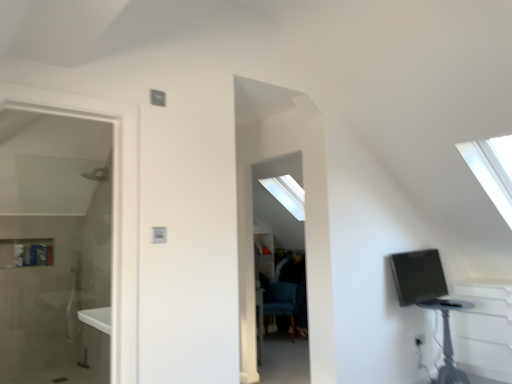
Question: Is the position of matte black monitor at right less distant than that of blue fabric swivel chair at center?

Choices:
 (A) yes
 (B) no

Answer: (A)

Question: Is the depth of matte black monitor at right greater than that of blue fabric swivel chair at center?

Choices:
 (A) no
 (B) yes

Answer: (A)

Question: Would you consider matte black monitor at right to be distant from blue fabric swivel chair at center?

Choices:
 (A) no
 (B) yes

Answer: (B)

Question: From the image's perspective, does matte black monitor at right appear higher than blue fabric swivel chair at center?

Choices:
 (A) yes
 (B) no

Answer: (A)

Question: Can you confirm if matte black monitor at right is shorter than blue fabric swivel chair at center?

Choices:
 (A) no
 (B) yes

Answer: (B)

Question: Does point (265, 284) appear closer or farther from the camera than point (443, 380)?

Choices:
 (A) farther
 (B) closer

Answer: (A)

Question: Considering the positions of blue fabric swivel chair at center and black plastic table at lower right in the image, is blue fabric swivel chair at center bigger or smaller than black plastic table at lower right?

Choices:
 (A) big
 (B) small

Answer: (B)

Question: Looking at their shapes, would you say blue fabric swivel chair at center is wider or thinner than black plastic table at lower right?

Choices:
 (A) thin
 (B) wide

Answer: (A)

Question: From a real-world perspective, is blue fabric swivel chair at center positioned above or below black plastic table at lower right?

Choices:
 (A) below
 (B) above

Answer: (A)

Question: Is black plastic table at lower right taller or shorter than blue fabric swivel chair at center?

Choices:
 (A) short
 (B) tall

Answer: (B)

Question: Is black plastic table at lower right in front of or behind blue fabric swivel chair at center in the image?

Choices:
 (A) front
 (B) behind

Answer: (A)

Question: Considering the positions of point (445, 309) and point (269, 312), is point (445, 309) closer or farther from the camera than point (269, 312)?

Choices:
 (A) closer
 (B) farther

Answer: (A)

Question: Considering the positions of black plastic table at lower right and blue fabric swivel chair at center in the image, is black plastic table at lower right wider or thinner than blue fabric swivel chair at center?

Choices:
 (A) wide
 (B) thin

Answer: (A)

Question: Is matte black monitor at right inside or outside of blue fabric swivel chair at center?

Choices:
 (A) inside
 (B) outside

Answer: (B)

Question: In terms of height, does matte black monitor at right look taller or shorter compared to blue fabric swivel chair at center?

Choices:
 (A) tall
 (B) short

Answer: (B)